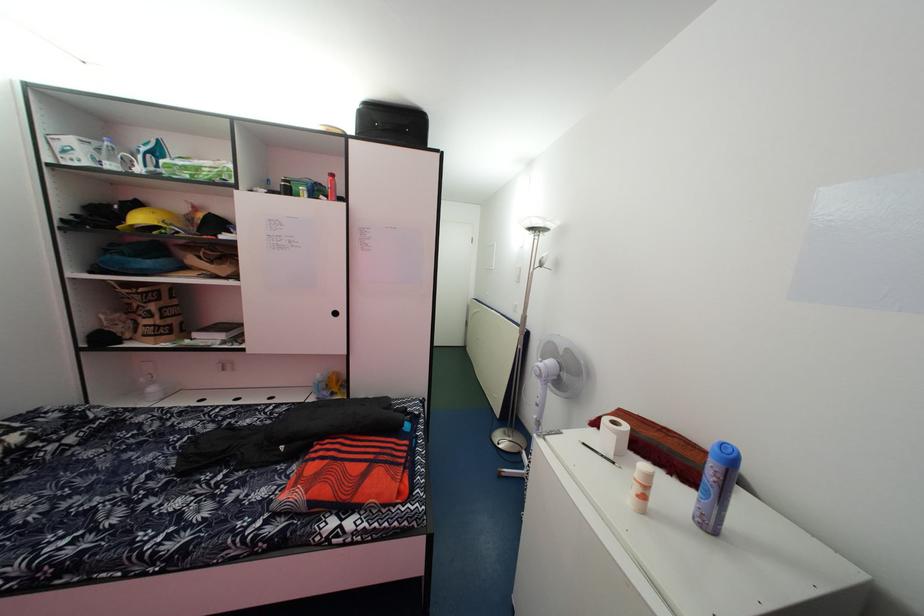
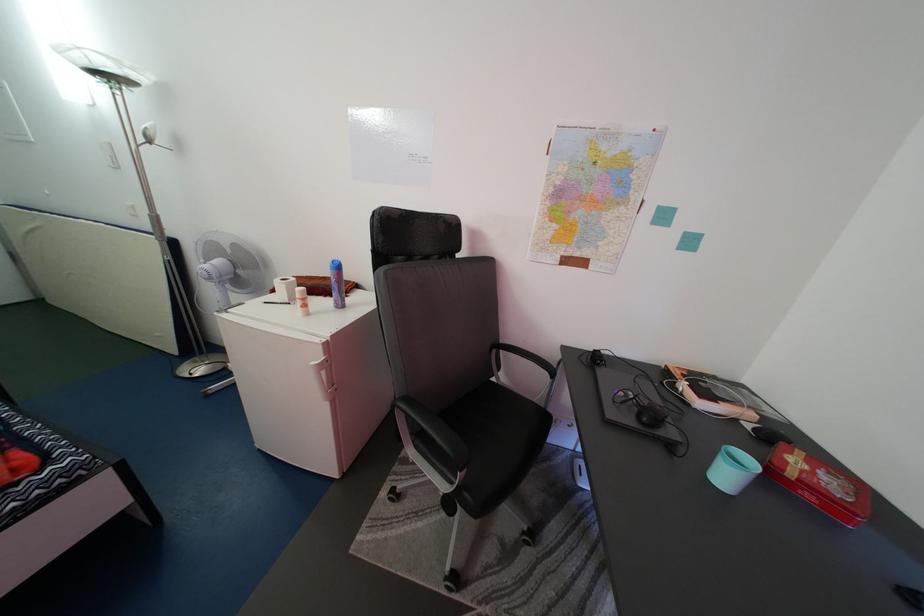
Locate, in the second image, the point that corresponds to point (577, 358) in the first image.

(244, 253)